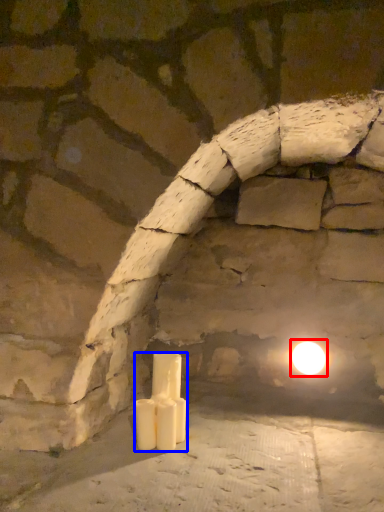
Question: Which object appears farthest to the camera in this image, moonlight (highlighted by a red box) or candle (highlighted by a blue box)?

Choices:
 (A) moonlight
 (B) candle

Answer: (A)